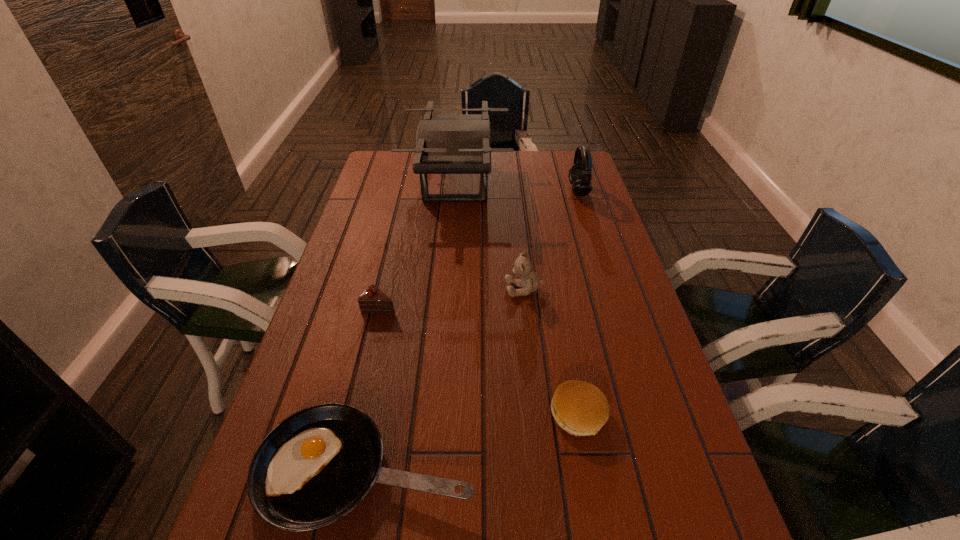
The image size is (960, 540). I want to click on vacant space situated 0.390m on the earcups of the rightmost object, so click(x=462, y=191).

Locate an element on the screen. free spot located 0.360m on the face of the teddy bear is located at coordinates coord(374,289).

Where is `blank area located on the face of the teddy bear`? The height and width of the screenshot is (540, 960). blank area located on the face of the teddy bear is located at coordinates (407, 289).

You are a GUI agent. You are given a task and a screenshot of the screen. Output one action in this format:
    pyautogui.click(x=<x>, y=<y>)
    Task: Click on the vacant space located 0.140m on the face of the teddy bear
    This screenshot has width=960, height=540.
    Given the screenshot: What is the action you would take?
    pyautogui.click(x=454, y=289)

Find the location of a particular element. The image size is (960, 540). free location located 0.170m on the front of the chocolate cake is located at coordinates (365, 369).

You are a GUI agent. You are given a task and a screenshot of the screen. Output one action in this format:
    pyautogui.click(x=<x>, y=<y>)
    Task: Click on the free space located 0.250m on the left of the patty
    The width and height of the screenshot is (960, 540).
    Given the screenshot: What is the action you would take?
    pyautogui.click(x=432, y=414)

Where is `free space located 0.190m on the right of the frying pan`? Image resolution: width=960 pixels, height=540 pixels. free space located 0.190m on the right of the frying pan is located at coordinates (574, 469).

Locate an element on the screen. This screenshot has height=540, width=960. drone that is at the far edge is located at coordinates (445, 143).

Locate an element on the screen. headset situated at the far edge is located at coordinates (580, 173).

The image size is (960, 540). What are the coordinates of `drone located in the left edge section of the desktop` in the screenshot? It's located at (445, 143).